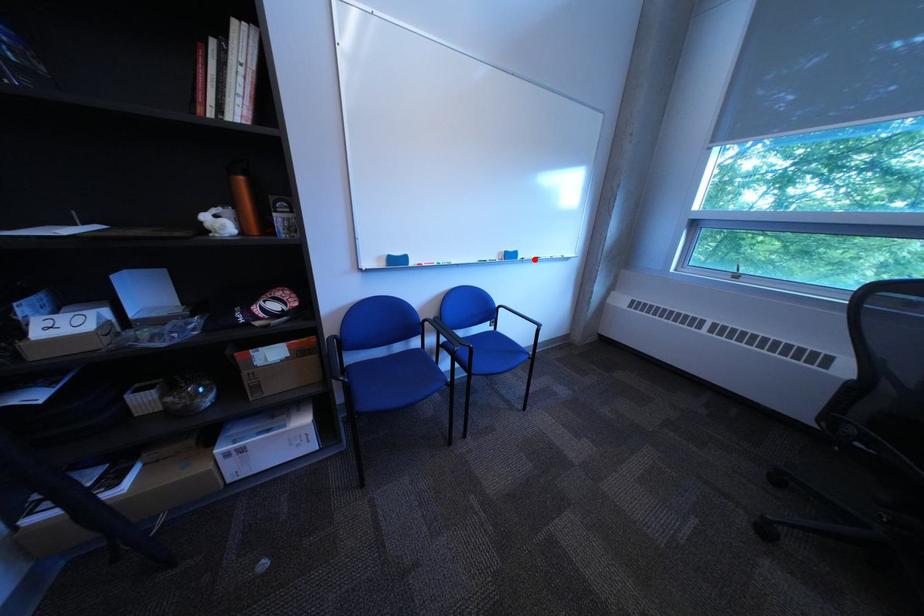
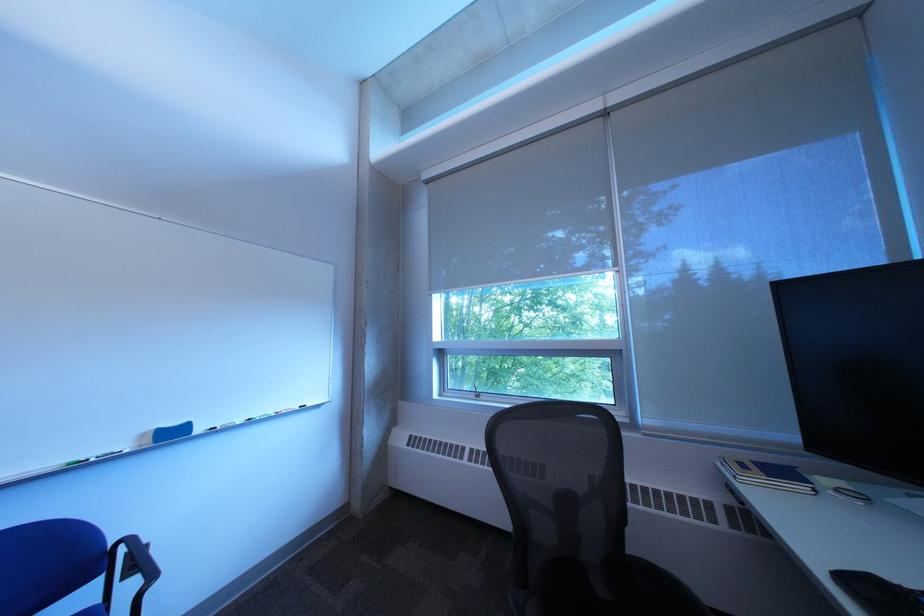
In the second image, find the point that corresponds to the highlighted location in the first image.

(213, 432)